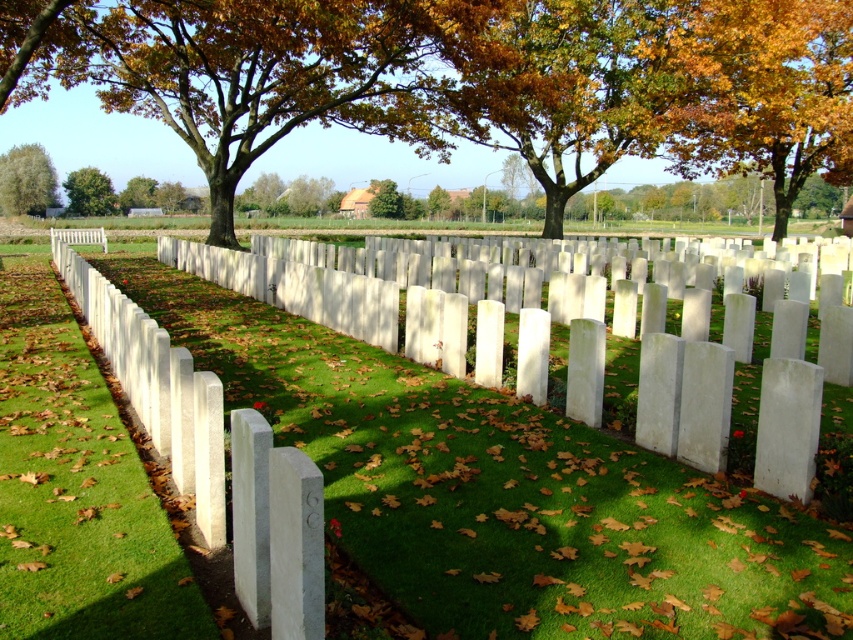
Is point (784, 218) more distant than point (91, 188)?

No, it is in front of (91, 188).

Who is higher up, golden leafy tree at upper right or green leafy tree at upper left?

green leafy tree at upper left is above.

Where is `golden leafy tree at upper right`? golden leafy tree at upper right is located at coordinates (764, 93).

Is brown leafy tree at upper center positioned behind green leafy tree at upper left?

That is False.

Does brown leafy tree at upper center have a greater width compared to green leafy tree at upper left?

Yes.

Is point (788, 67) farther from camera compared to point (77, 172)?

No, (788, 67) is in front of (77, 172).

Find the location of a particular element. This screenshot has width=853, height=640. brown leafy tree at upper center is located at coordinates (489, 81).

How much distance is there between brown leafy tree at upper center and golden leafy tree at upper right?

The distance of brown leafy tree at upper center from golden leafy tree at upper right is 4.05 meters.

Is brown leafy tree at upper center in front of golden leafy tree at upper right?

Yes, it is.

Which is behind, point (788, 12) or point (714, 49)?

Point (714, 49)

Locate an element on the screen. Image resolution: width=853 pixels, height=640 pixels. brown leafy tree at upper center is located at coordinates (489, 81).